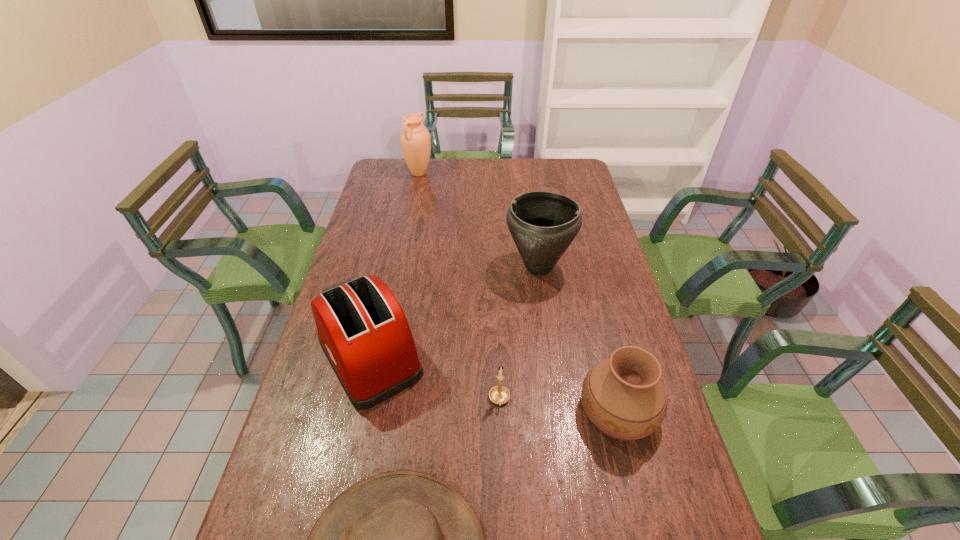
The height and width of the screenshot is (540, 960). In order to click on the farthest object in this screenshot , I will do `click(415, 140)`.

The width and height of the screenshot is (960, 540). What are the coordinates of `the farthest urn` in the screenshot? It's located at (415, 140).

Image resolution: width=960 pixels, height=540 pixels. I want to click on the second farthest object, so pos(543,224).

This screenshot has height=540, width=960. What are the coordinates of `toaster` in the screenshot? It's located at (362, 329).

The height and width of the screenshot is (540, 960). Identify the location of the shortest urn. (623, 396).

Identify the location of the nearest urn. The width and height of the screenshot is (960, 540). (623, 396).

Where is `candle holder`? The width and height of the screenshot is (960, 540). candle holder is located at coordinates [x=499, y=394].

Identify the location of the second shortest object. (499, 394).

At what (x,y) coordinates should I click in order to perform the action: click on vacant space situated 0.160m on the front of the leftmost urn. Please return your answer as a coordinate pair (x, y). This screenshot has height=540, width=960. Looking at the image, I should click on (413, 201).

Where is `vacant space positioned on the back of the fifth nearest object`? vacant space positioned on the back of the fifth nearest object is located at coordinates (530, 212).